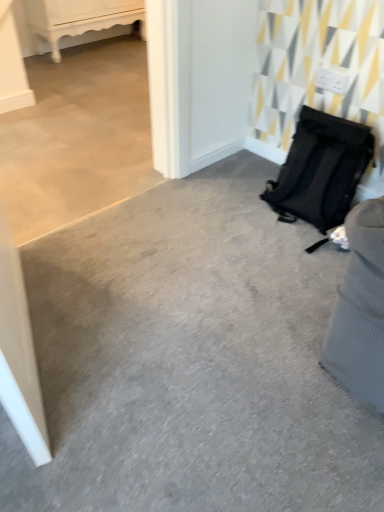
Question: Can you confirm if matte black backpack at right is taller than black fabric backpack at right?

Choices:
 (A) yes
 (B) no

Answer: (A)

Question: Could you tell me if matte black backpack at right is turned towards black fabric backpack at right?

Choices:
 (A) no
 (B) yes

Answer: (B)

Question: From a real-world perspective, is matte black backpack at right on top of black fabric backpack at right?

Choices:
 (A) yes
 (B) no

Answer: (A)

Question: Does matte black backpack at right have a lesser width compared to black fabric backpack at right?

Choices:
 (A) yes
 (B) no

Answer: (A)

Question: Can you confirm if matte black backpack at right is bigger than black fabric backpack at right?

Choices:
 (A) yes
 (B) no

Answer: (B)

Question: Does matte black backpack at right appear on the left side of black fabric backpack at right?

Choices:
 (A) no
 (B) yes

Answer: (A)

Question: Can you confirm if matte black backpack at right is wider than white glossy cabinet at upper left?

Choices:
 (A) yes
 (B) no

Answer: (A)

Question: From a real-world perspective, is matte black backpack at right on white glossy cabinet at upper left?

Choices:
 (A) yes
 (B) no

Answer: (B)

Question: Considering the relative sizes of matte black backpack at right and white glossy cabinet at upper left in the image provided, is matte black backpack at right taller than white glossy cabinet at upper left?

Choices:
 (A) yes
 (B) no

Answer: (B)

Question: Considering the relative sizes of matte black backpack at right and white glossy cabinet at upper left in the image provided, is matte black backpack at right smaller than white glossy cabinet at upper left?

Choices:
 (A) no
 (B) yes

Answer: (B)

Question: Does matte black backpack at right have a lesser height compared to white glossy cabinet at upper left?

Choices:
 (A) no
 (B) yes

Answer: (B)

Question: Can we say matte black backpack at right lies outside white glossy cabinet at upper left?

Choices:
 (A) yes
 (B) no

Answer: (A)

Question: Can you confirm if white glossy cabinet at upper left is taller than black fabric backpack at right?

Choices:
 (A) yes
 (B) no

Answer: (A)